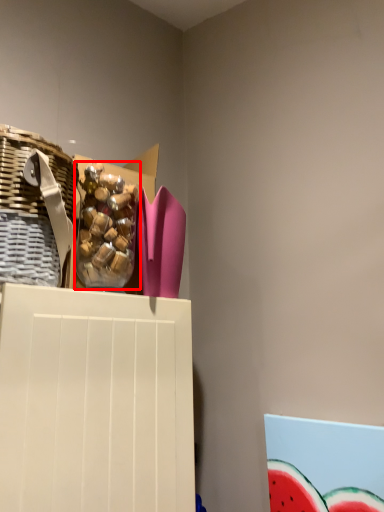
Question: From the image's perspective, what is the correct spatial positioning of food (annotated by the red box) in reference to basket?

Choices:
 (A) above
 (B) below

Answer: (B)